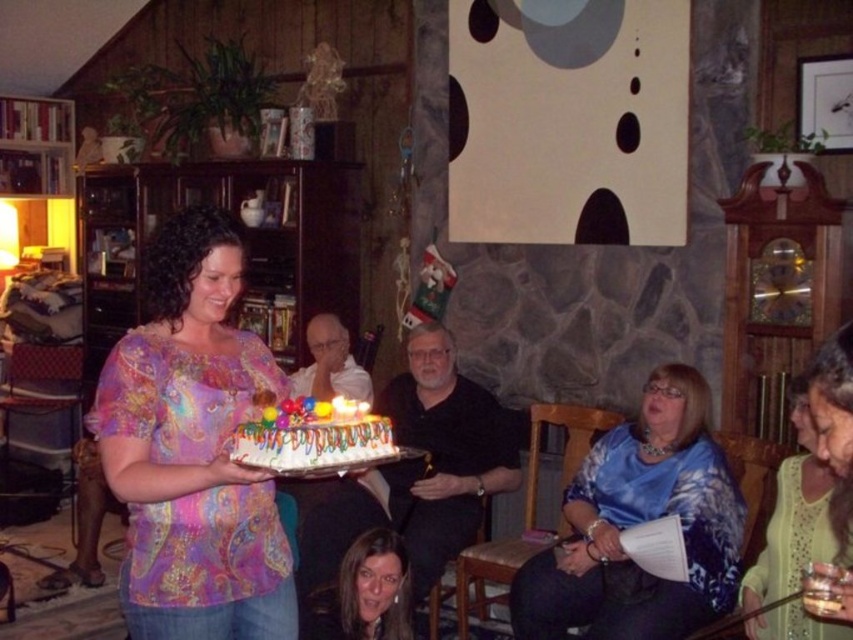
Question: Among these objects, which one is nearest to the camera?

Choices:
 (A) blue floral blouse at center
 (B) light green lace dress at lower right

Answer: (B)

Question: Can you confirm if white frosted cake with colorful decorations at center is positioned to the left of smooth brown hair at lower center?

Choices:
 (A) no
 (B) yes

Answer: (B)

Question: Which point appears closest to the camera in this image?

Choices:
 (A) (171, 308)
 (B) (341, 627)
 (C) (248, 428)
 (D) (792, 608)

Answer: (C)

Question: Is multicolored paisley shirt at center positioned behind white frosted cake with colorful decorations at center?

Choices:
 (A) yes
 (B) no

Answer: (A)

Question: Estimate the real-world distances between objects in this image. Which object is farther from the white frosted cake with colorful decorations at center?

Choices:
 (A) light green lace dress at lower right
 (B) blue floral blouse at center

Answer: (B)

Question: Can you confirm if light green lace dress at lower right is bigger than white frosted cake with colorful decorations at center?

Choices:
 (A) no
 (B) yes

Answer: (B)